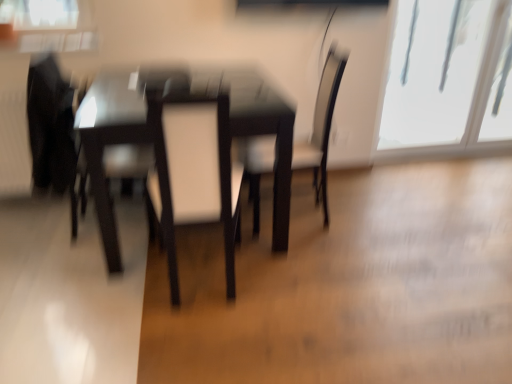
Image resolution: width=512 pixels, height=384 pixels. In order to click on vacant region to the left of white leather swivel chair at center, arranged as the first swivel chair when viewed from the right in this screenshot , I will do `click(103, 294)`.